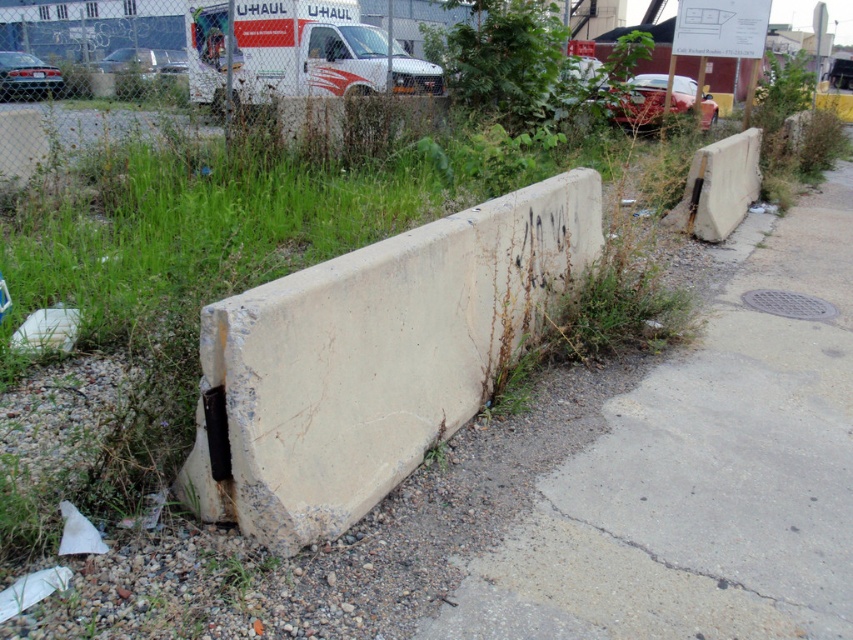
Who is positioned more to the left, concrete pavement at lower right or white matte van at upper center?

Positioned to the left is white matte van at upper center.

Is concrete pavement at lower right bigger than white matte van at upper center?

No.

Locate an element on the screen. The width and height of the screenshot is (853, 640). concrete pavement at lower right is located at coordinates (703, 476).

At what (x,y) coordinates should I click in order to perform the action: click on concrete pavement at lower right. Please return your answer as a coordinate pair (x, y). The height and width of the screenshot is (640, 853). Looking at the image, I should click on (703, 476).

Is point (244, 490) positioned in front of point (373, 150)?

Yes, it is.

Does white concrete barrier at center appear on the right side of white matte van at upper center?

Correct, you'll find white concrete barrier at center to the right of white matte van at upper center.

I want to click on white concrete barrier at center, so click(373, 358).

Where is `white concrete barrier at center`? The height and width of the screenshot is (640, 853). white concrete barrier at center is located at coordinates (373, 358).

Is concrete pavement at lower right wider than white concrete barrier at center?

Yes, concrete pavement at lower right is wider than white concrete barrier at center.

Who is positioned more to the right, concrete pavement at lower right or white concrete barrier at center?

concrete pavement at lower right

Does point (793, 280) come in front of point (372, 416)?

No, it is behind (372, 416).

At what (x,y) coordinates should I click in order to perform the action: click on concrete pavement at lower right. Please return your answer as a coordinate pair (x, y). Image resolution: width=853 pixels, height=640 pixels. Looking at the image, I should click on (703, 476).